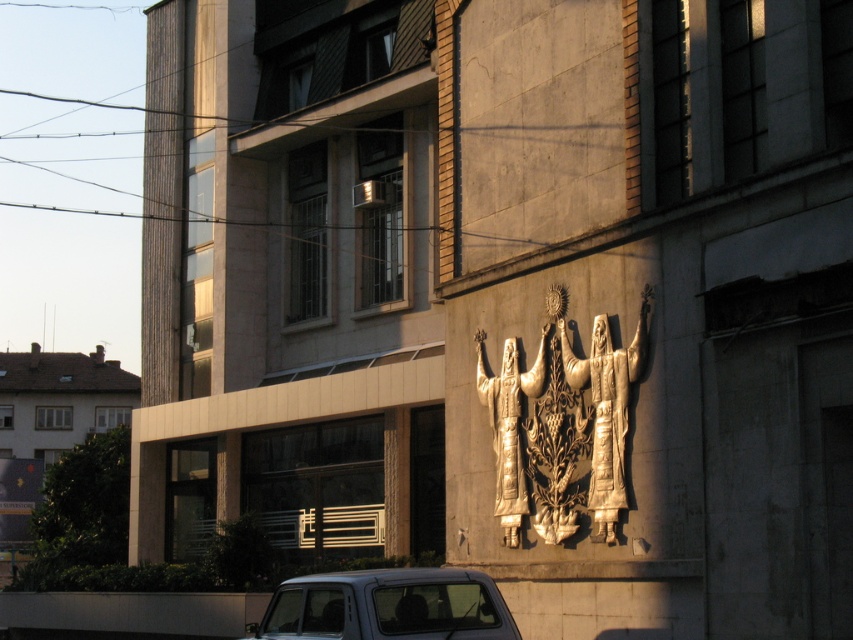
Question: Which of the following is the closest to the observer?

Choices:
 (A) gold textured statue at center
 (B) metallic silver car at lower center

Answer: (B)

Question: Is metallic silver car at lower center thinner than gold textured relief at center?

Choices:
 (A) yes
 (B) no

Answer: (B)

Question: Which object is farther from the camera taking this photo?

Choices:
 (A) metallic silver car at lower center
 (B) gold textured statue at center
 (C) gold textured relief at center

Answer: (B)

Question: Can you confirm if gold textured relief at center is positioned above gold textured statue at center?

Choices:
 (A) no
 (B) yes

Answer: (B)

Question: From the image, what is the correct spatial relationship of metallic silver car at lower center in relation to gold textured statue at center?

Choices:
 (A) left
 (B) right

Answer: (A)

Question: Among these points, which one is farthest from the camera?

Choices:
 (A) (618, 352)
 (B) (476, 572)

Answer: (A)